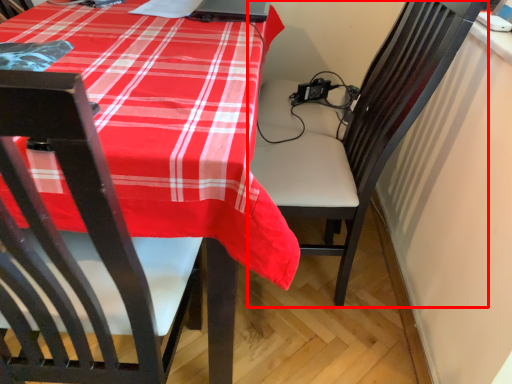
Question: Where is chair (annotated by the red box) located in relation to laptop in the image?

Choices:
 (A) left
 (B) right

Answer: (B)